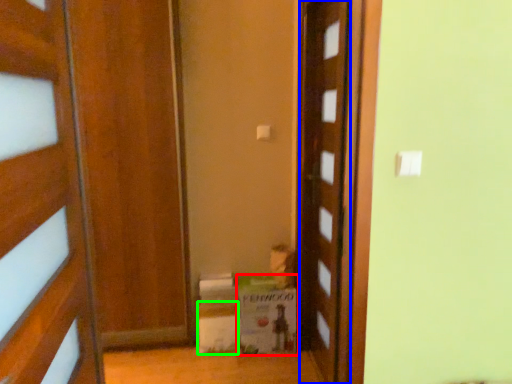
Question: Estimate the real-world distances between objects in this image. Which object is farther from cardboard box (highlighted by a red box), door (highlighted by a blue box) or cardboard box (highlighted by a green box)?

Choices:
 (A) door
 (B) cardboard box

Answer: (A)